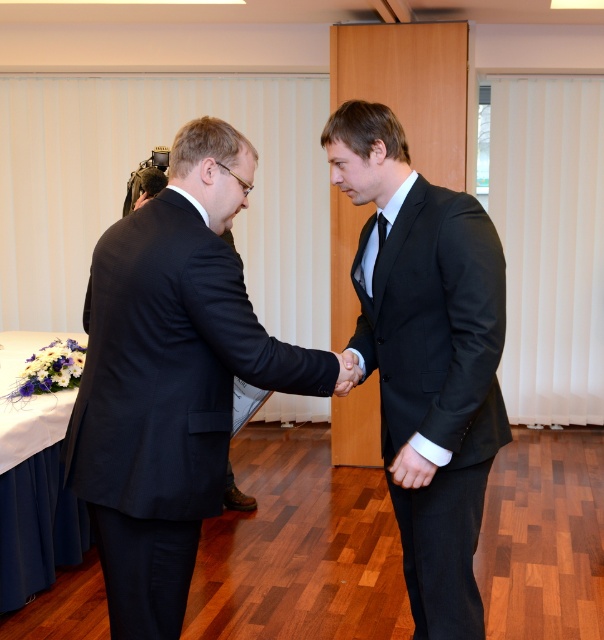
Question: Can you confirm if black textured suit at center is positioned above black matte hand at center?

Choices:
 (A) yes
 (B) no

Answer: (B)

Question: Which is farther from the black textured suit at center?

Choices:
 (A) black satin suit at center
 (B) black matte hand at center

Answer: (A)

Question: Among these points, which one is farthest from the camera?

Choices:
 (A) (123, 246)
 (B) (417, 620)
 (C) (387, 220)

Answer: (B)

Question: Which object appears farthest from the camera in this image?

Choices:
 (A) black silk tie at center
 (B) black textured suit at center

Answer: (A)

Question: Does black textured suit at center appear over black satin suit at center?

Choices:
 (A) yes
 (B) no

Answer: (B)

Question: Is black matte hand at center wider than black silk tie at center?

Choices:
 (A) yes
 (B) no

Answer: (A)